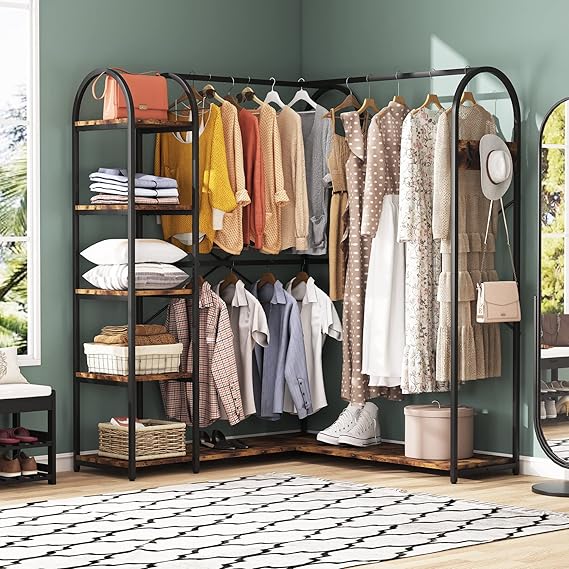
Where is `wood shelf panels`? wood shelf panels is located at coordinates (170, 119), (176, 204), (171, 288), (172, 375), (170, 459), (302, 437).